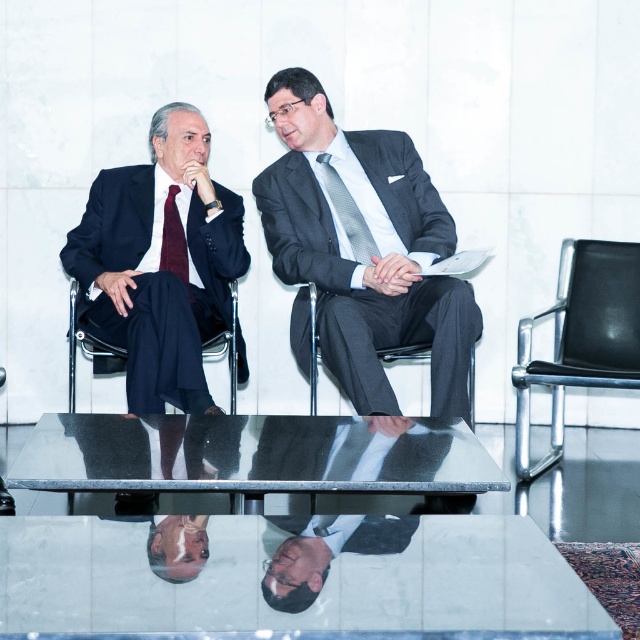
You are standing in the room and want to reach the point at coordinates point (x=628, y=340). The chairs are 1.2 meters wide. Can you walk through the space between the chairs and the table to reach the point?

The point (x=628, y=340) is 3.47 meters away from the viewer. Since the chairs are only 1.2 meters wide, you can walk around them to reach the point as long as there is enough space between the chairs and the table.

You are a photographer setting up a shoot in this scene. You need to position a light source to the right of the black leather chair at right and to the left of the burgundy silk tie at left. Is this possible given their positions?

The black leather chair at right is to the right of the burgundy silk tie at left, so placing a light source to the right of the black leather chair at right and to the left of the burgundy silk tie at left is not possible because the burgundy silk tie at left is already to the left of the black leather chair at right.